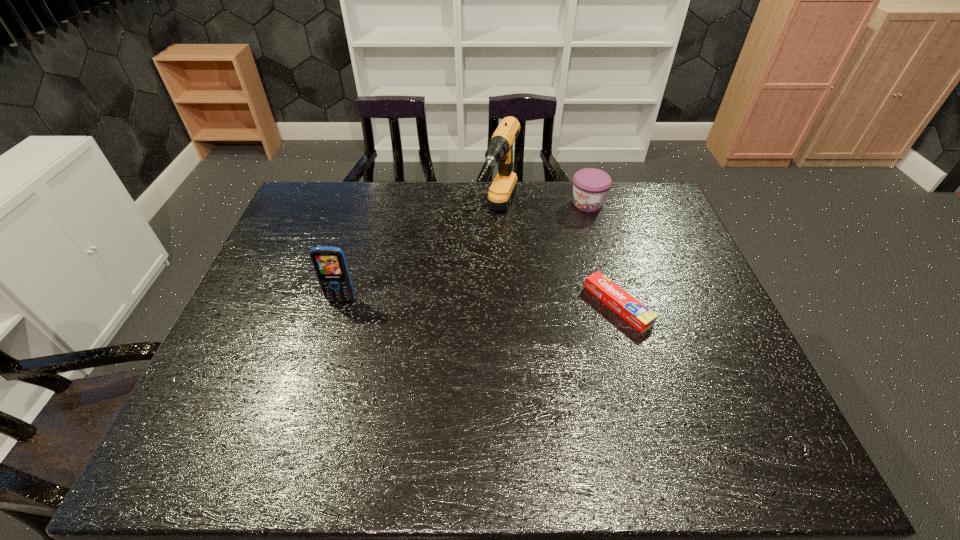
The image size is (960, 540). In order to click on free space at the far right corner in this screenshot , I will do `click(657, 198)`.

Locate an element on the screen. free spot between the second object from left to right and the leftmost object is located at coordinates (420, 256).

This screenshot has height=540, width=960. I want to click on free space between the tallest object and the jam, so click(543, 208).

Find the location of a particular element. The width and height of the screenshot is (960, 540). free space between the cellular telephone and the jam is located at coordinates (465, 252).

Image resolution: width=960 pixels, height=540 pixels. Identify the location of unoccupied area between the second shortest object and the toothpaste. (603, 254).

You are a GUI agent. You are given a task and a screenshot of the screen. Output one action in this format:
    pyautogui.click(x=<x>, y=<y>)
    Task: Click on the free space between the cellular telephone and the tallest object
    This screenshot has width=960, height=540.
    Given the screenshot: What is the action you would take?
    click(420, 256)

I want to click on vacant space that's between the shortest object and the third shortest object, so click(480, 302).

Where is `free space between the drill and the leftmost object`? free space between the drill and the leftmost object is located at coordinates (420, 256).

I want to click on free space that is in between the jam and the leftmost object, so click(465, 252).

The width and height of the screenshot is (960, 540). Identify the location of blank region between the toothpaste and the cellular telephone. (480, 302).